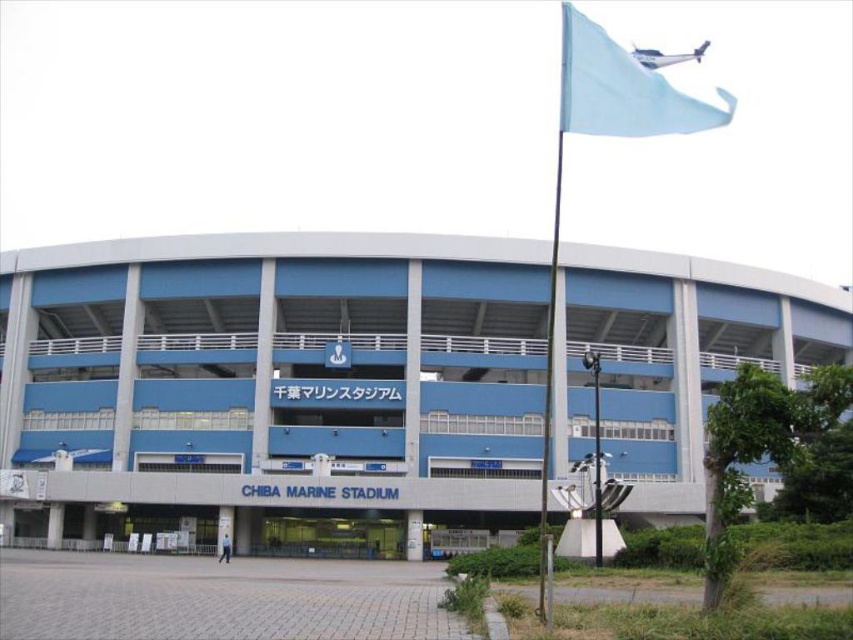
Does blue concrete stadium at center appear on the left side of blue metallic flag pole at center-right?

Yes, blue concrete stadium at center is to the left of blue metallic flag pole at center-right.

Who is shorter, blue concrete stadium at center or blue metallic flag pole at center-right?

With less height is blue concrete stadium at center.

Where is `blue concrete stadium at center`? This screenshot has width=853, height=640. blue concrete stadium at center is located at coordinates (271, 385).

Is light blue fabric flag at upper right below blue metallic flag pole at center-right?

No.

Image resolution: width=853 pixels, height=640 pixels. Describe the element at coordinates (622, 90) in the screenshot. I see `light blue fabric flag at upper right` at that location.

Where is `light blue fabric flag at upper right`? light blue fabric flag at upper right is located at coordinates (622, 90).

Between point (599, 252) and point (679, 120), which one is positioned behind?

The point (599, 252) is behind.

Consider the image. Does blue concrete stadium at center have a lesser width compared to light blue fabric flag at upper right?

No, blue concrete stadium at center is not thinner than light blue fabric flag at upper right.

In order to click on blue concrete stadium at center in this screenshot , I will do `click(271, 385)`.

The width and height of the screenshot is (853, 640). Identify the location of blue concrete stadium at center. (271, 385).